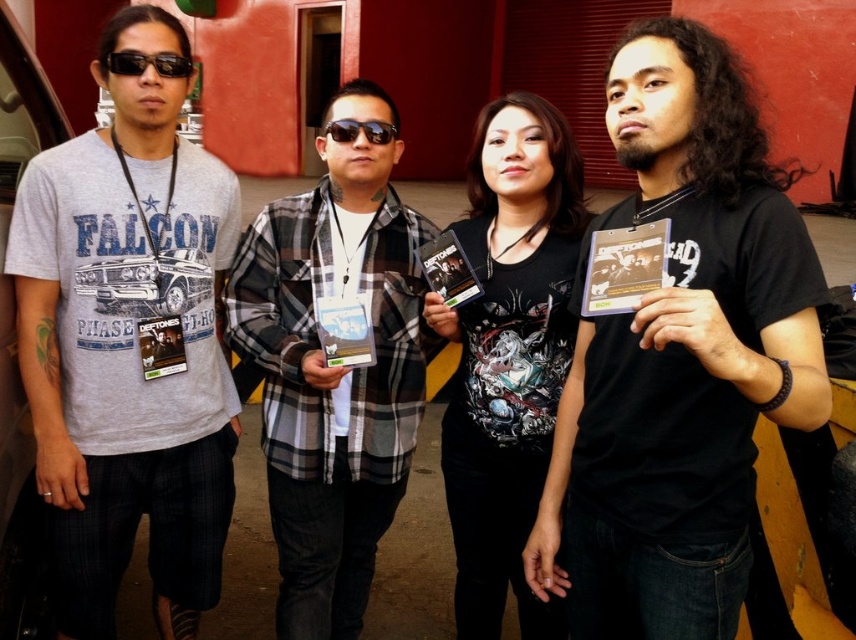
Who is shorter, plaid flannel shirt at center or matte plastic dvd case at center?

matte plastic dvd case at center is shorter.

Is plaid flannel shirt at center positioned in front of matte plastic dvd case at center?

Yes.

Is point (325, 248) positioned behind point (464, 304)?

Yes, it is behind point (464, 304).

The width and height of the screenshot is (856, 640). I want to click on plaid flannel shirt at center, so click(334, 368).

Is matte black album at left taller than black plastic sunglasses at upper left?

Correct, matte black album at left is much taller as black plastic sunglasses at upper left.

Is matte black album at left behind black plastic sunglasses at upper left?

Yes.

Identify the location of matte black album at left. (161, 346).

Describe the element at coordinates (681, 356) in the screenshot. I see `black matte t-shirt at center` at that location.

Does black matte t-shirt at center have a lesser width compared to matte plastic dvd case at center?

No.

Does point (753, 424) lie behind point (470, 276)?

No, (753, 424) is in front of (470, 276).

Image resolution: width=856 pixels, height=640 pixels. In order to click on black matte t-shirt at center in this screenshot , I will do pos(681,356).